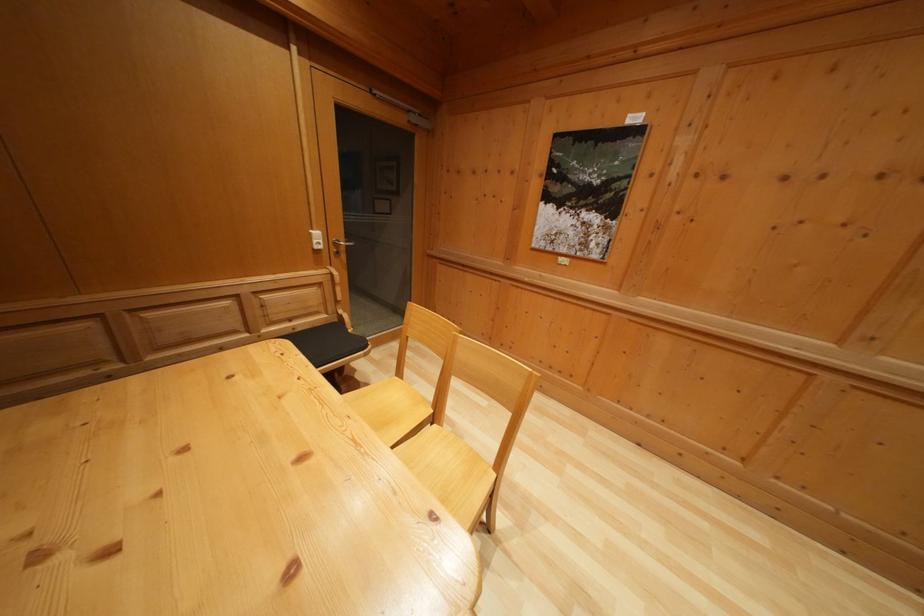
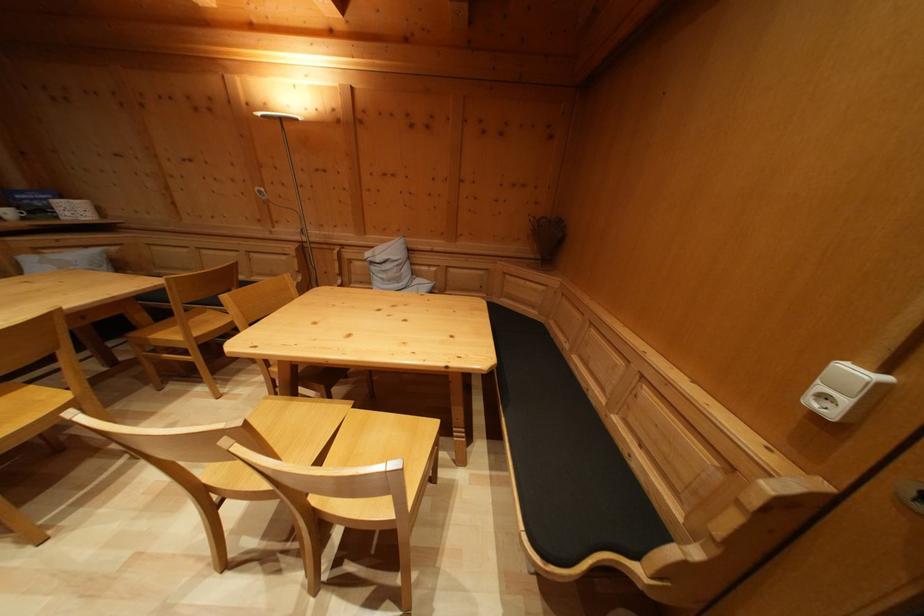
Find the pixel in the second image that matches the point at 322,240 in the first image.

(859, 379)